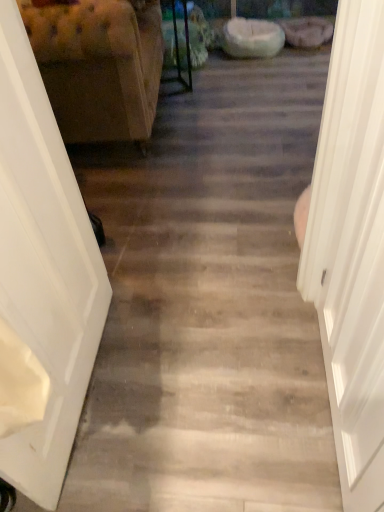
Question: Is white smooth door at right, the 1th door viewed from the right, at the left side of tufted fabric armchair at left?

Choices:
 (A) no
 (B) yes

Answer: (A)

Question: Could you tell me if white smooth door at right, the 1th door viewed from the right, is facing tufted fabric armchair at left?

Choices:
 (A) yes
 (B) no

Answer: (B)

Question: From a real-world perspective, is white smooth door at right, placed as the 2th door when sorted from left to right, on tufted fabric armchair at left?

Choices:
 (A) yes
 (B) no

Answer: (A)

Question: From the image's perspective, is white smooth door at right, placed as the 2th door when sorted from left to right, located above tufted fabric armchair at left?

Choices:
 (A) no
 (B) yes

Answer: (A)

Question: Is the depth of white smooth door at right, placed as the 2th door when sorted from left to right, greater than that of tufted fabric armchair at left?

Choices:
 (A) yes
 (B) no

Answer: (B)

Question: Is white smooth door at right, the 1th door viewed from the right, looking in the opposite direction of tufted fabric armchair at left?

Choices:
 (A) no
 (B) yes

Answer: (A)

Question: Could white smooth door at right, the 1th door viewed from the right, be considered to be inside white glossy door at left, positioned as the second door in right-to-left order?

Choices:
 (A) no
 (B) yes

Answer: (A)

Question: Is white glossy door at left, the 1th door viewed from the left, next to white smooth door at right, the 1th door viewed from the right, and touching it?

Choices:
 (A) no
 (B) yes

Answer: (A)

Question: From the image's perspective, is white glossy door at left, positioned as the second door in right-to-left order, under white smooth door at right, placed as the 2th door when sorted from left to right?

Choices:
 (A) no
 (B) yes

Answer: (B)

Question: Does white glossy door at left, positioned as the second door in right-to-left order, lie behind white smooth door at right, the 1th door viewed from the right?

Choices:
 (A) no
 (B) yes

Answer: (B)

Question: Does white glossy door at left, positioned as the second door in right-to-left order, lie in front of white smooth door at right, placed as the 2th door when sorted from left to right?

Choices:
 (A) yes
 (B) no

Answer: (B)

Question: Does white glossy door at left, positioned as the second door in right-to-left order, have a lesser width compared to white smooth door at right, placed as the 2th door when sorted from left to right?

Choices:
 (A) no
 (B) yes

Answer: (B)

Question: Is white smooth door at right, the 1th door viewed from the right, closer to camera compared to white glossy door at left, positioned as the second door in right-to-left order?

Choices:
 (A) yes
 (B) no

Answer: (A)